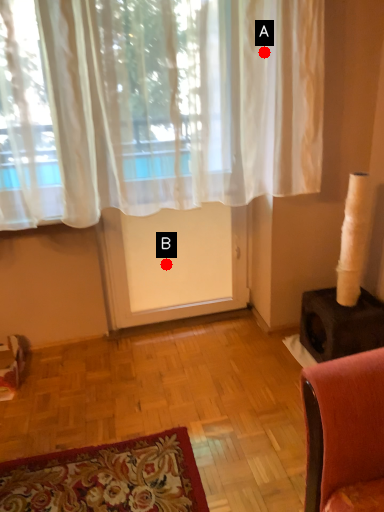
Question: Two points are circled on the image, labeled by A and B beside each circle. Which point is closer to the camera?

Choices:
 (A) A is closer
 (B) B is closer

Answer: (A)